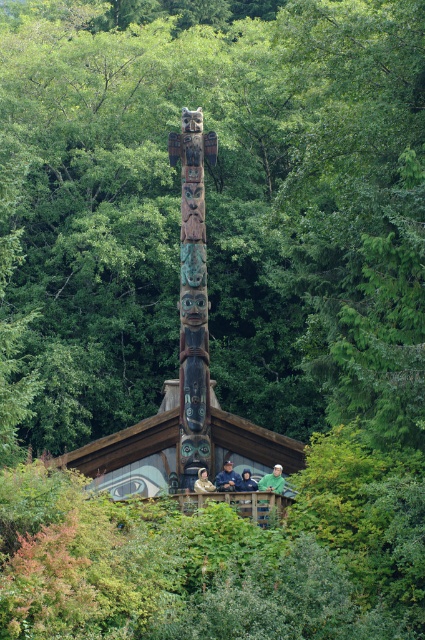
You are an artist who wants to paint a scene including both the carved wooden totem pole at center and the green matte shirt at center. Which object should you paint first if you want to follow the rule of painting larger objects before smaller ones?

You should paint the carved wooden wooden totem pole at center first because it is bigger than the green matte shirt at center.

You are an artist standing in front of the carved wooden totem pole at center and the green matte shirt at center. You want to take a photo of the totem pole without any obstructions. Which object should you move to ensure a clear view?

The green matte shirt at center is behind the carved wooden totem pole at center, so you should move the green matte shirt at center to ensure a clear view of the carved wooden totem pole at center.

You are standing in front of the totem pole and want to reach a specific point marked at coordinates point (95, 449). If you are currently 200 feet away from the totem pole, how much farther do you need to walk to reach that point?

The distance of point (95, 449) from viewer is 306.68 feet. Since you are currently 200 feet away from the totem pole, you need to walk an additional 106.68 feet to reach the point.